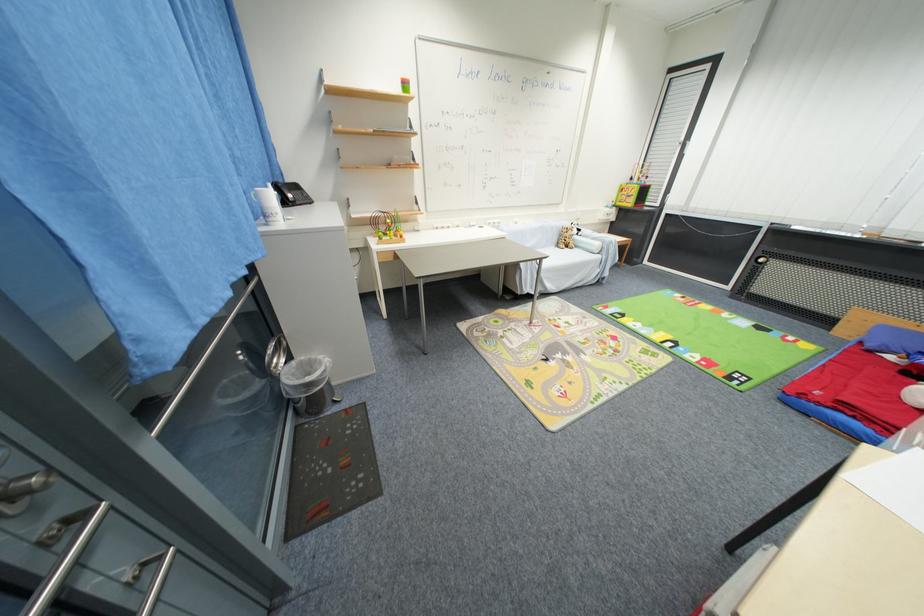
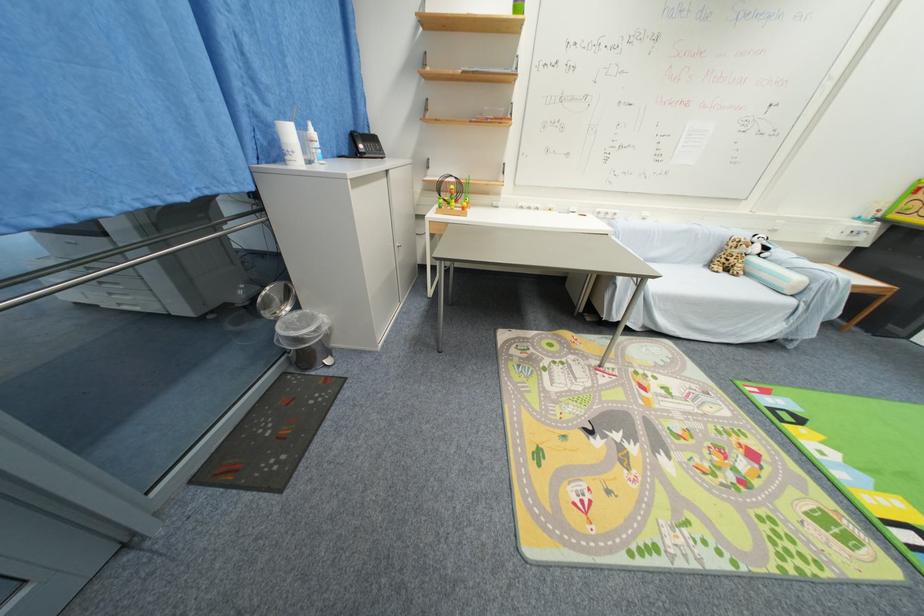
The point at (x=572, y=251) is marked in the first image. Where is the corresponding point in the second image?

(730, 276)